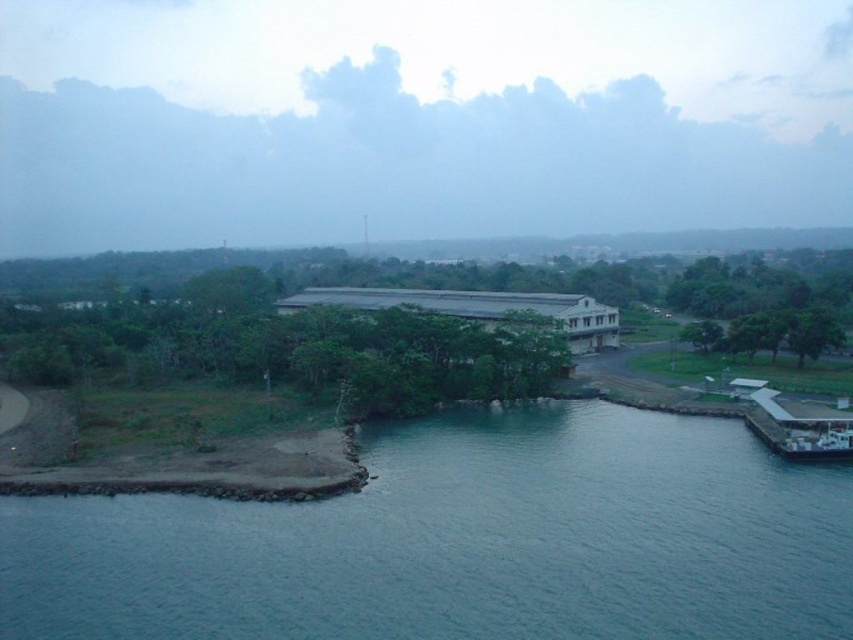
Question: Which point is closer to the camera?

Choices:
 (A) (219, 516)
 (B) (838, 440)

Answer: (A)

Question: Can you confirm if blue water at lower left is positioned below white glossy ferry at lower right?

Choices:
 (A) yes
 (B) no

Answer: (A)

Question: Does blue water at lower left have a larger size compared to white glossy ferry at lower right?

Choices:
 (A) no
 (B) yes

Answer: (B)

Question: Which point appears closest to the camera in this image?

Choices:
 (A) (822, 451)
 (B) (447, 552)

Answer: (B)

Question: Is blue water at lower left in front of white glossy ferry at lower right?

Choices:
 (A) yes
 (B) no

Answer: (A)